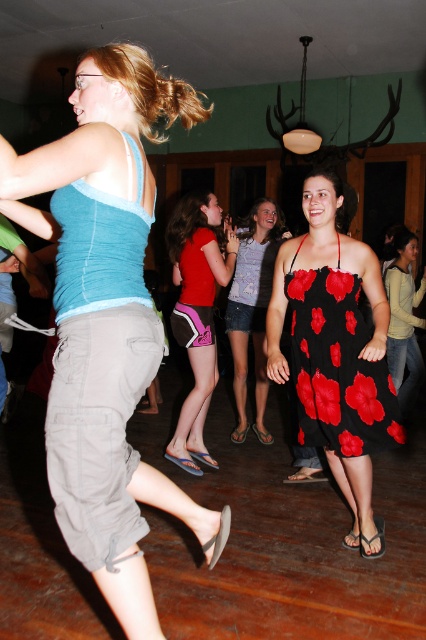
Question: Can you confirm if black floral dress at center is wider than matte green sweater at center?

Choices:
 (A) yes
 (B) no

Answer: (A)

Question: Can you confirm if floral print dress at center is positioned below matte green sweater at center?

Choices:
 (A) no
 (B) yes

Answer: (B)

Question: Among these objects, which one is farthest from the camera?

Choices:
 (A) matte red shorts at center
 (B) black floral dress at center

Answer: (A)

Question: Estimate the real-world distances between objects in this image. Which object is farther from the matte red shorts at center?

Choices:
 (A) floral print dress at center
 (B) matte green sweater at center
 (C) black floral dress at center

Answer: (B)

Question: Which object is positioned closest to the matte green sweater at center?

Choices:
 (A) matte blue tank top at center
 (B) black floral dress at center

Answer: (B)

Question: Is black floral dress at center wider than matte red shorts at center?

Choices:
 (A) yes
 (B) no

Answer: (A)